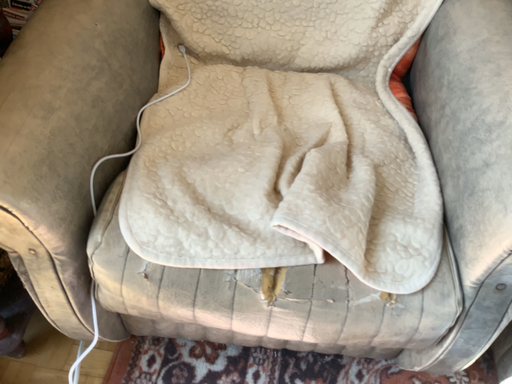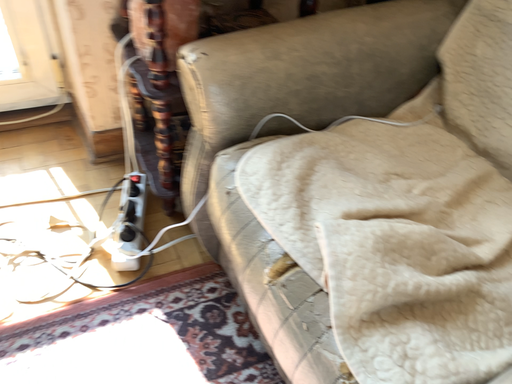
Question: How did the camera likely rotate when shooting the video?

Choices:
 (A) rotated left
 (B) rotated right

Answer: (A)